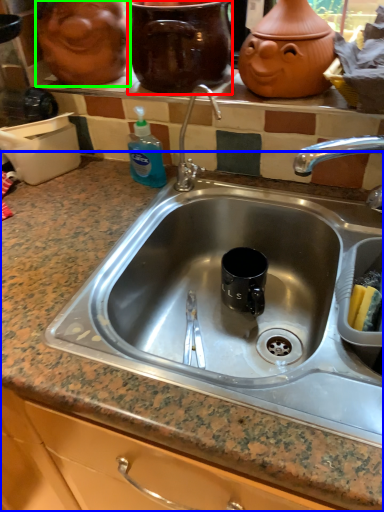
Question: Which object is positioned farthest from pottery (highlighted by a red box)? Select from countertop (highlighted by a blue box) and face (highlighted by a green box).

Choices:
 (A) countertop
 (B) face

Answer: (A)